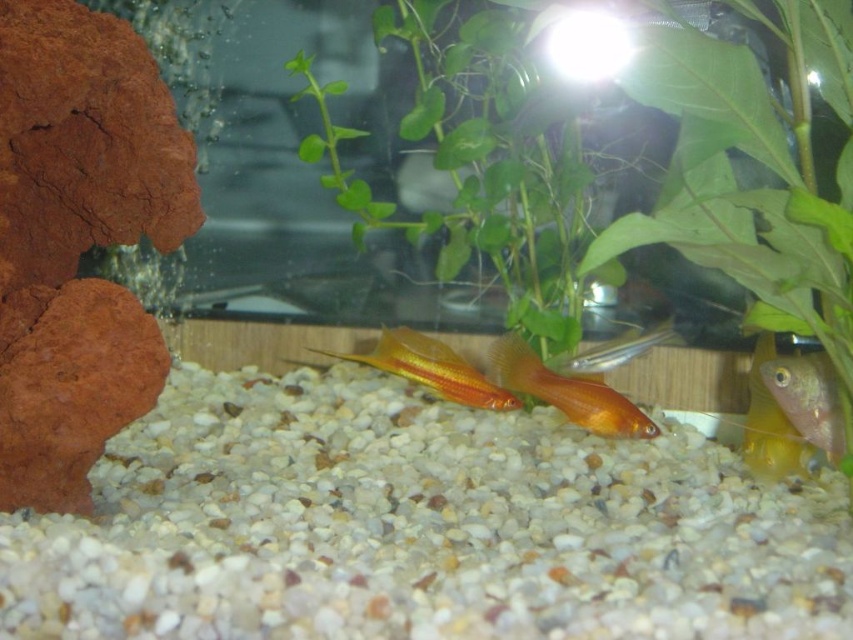
Between goldfish at center and translucent yellow fish at lower right, which one is positioned lower?

translucent yellow fish at lower right is lower down.

Who is positioned more to the right, goldfish at center or translucent yellow fish at lower right?

Positioned to the right is translucent yellow fish at lower right.

Identify the location of goldfish at center. (567, 392).

Is green leafy plant at center above goldfish at center?

Indeed, green leafy plant at center is positioned over goldfish at center.

What are the coordinates of `green leafy plant at center` in the screenshot? It's located at (587, 172).

You are a GUI agent. You are given a task and a screenshot of the screen. Output one action in this format:
    pyautogui.click(x=<x>, y=<y>)
    Task: Click on the green leafy plant at center
    The width and height of the screenshot is (853, 640).
    Given the screenshot: What is the action you would take?
    pyautogui.click(x=587, y=172)

Who is positioned more to the left, goldfish at center or shiny gold fish at center?

Positioned to the left is goldfish at center.

Which is in front, point (653, 433) or point (610, 340)?

Point (653, 433)

I want to click on goldfish at center, so click(x=567, y=392).